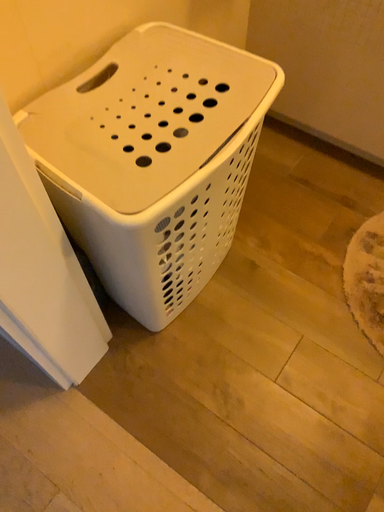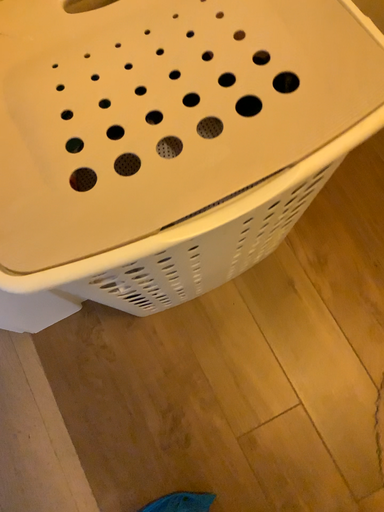
Question: How did the camera likely rotate when shooting the video?

Choices:
 (A) rotated downward
 (B) rotated upward

Answer: (A)